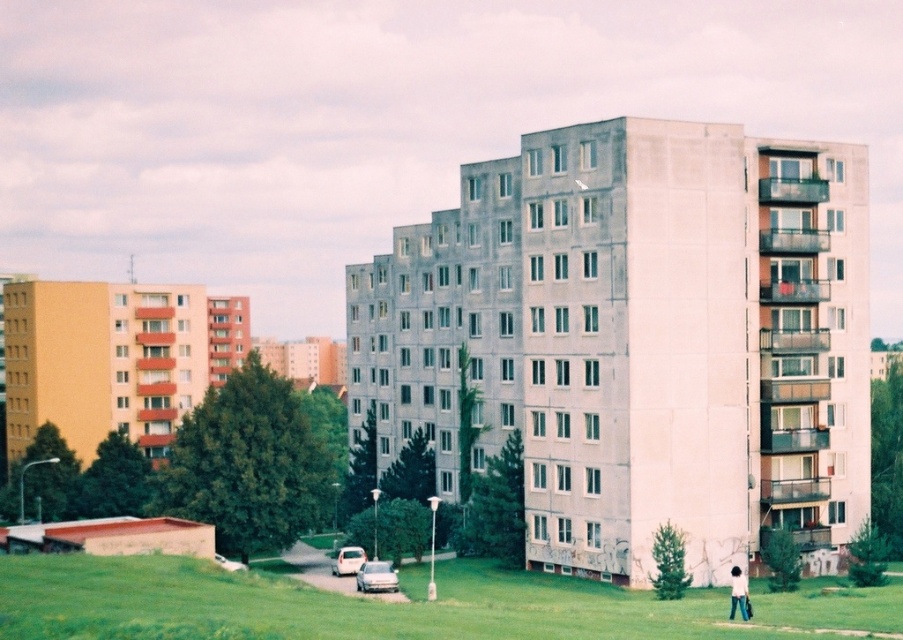
Based on the photo, who is taller, green grass at lower center or light brown hair at lower right?

green grass at lower center

Is green grass at lower center above light brown hair at lower right?

Indeed, green grass at lower center is positioned over light brown hair at lower right.

This screenshot has width=903, height=640. What are the coordinates of `green grass at lower center` in the screenshot? It's located at point(397,604).

Find the location of `green grass at lower center`. green grass at lower center is located at coordinates (397, 604).